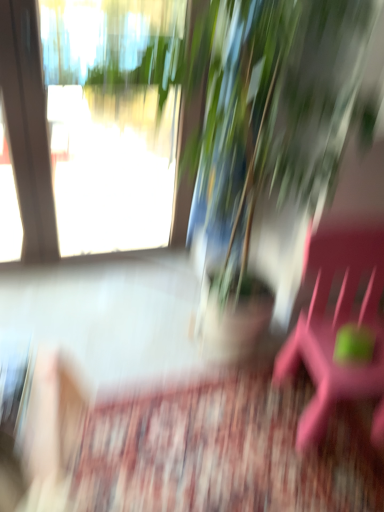
Question: Considering the relative positions of pink plastic beach chair at right and green leafy plant at upper center in the image provided, is pink plastic beach chair at right to the left or to the right of green leafy plant at upper center?

Choices:
 (A) right
 (B) left

Answer: (A)

Question: From a real-world perspective, is pink plastic beach chair at right positioned above or below green leafy plant at upper center?

Choices:
 (A) above
 (B) below

Answer: (B)

Question: From the image's perspective, is pink plastic beach chair at right above or below green leafy plant at upper center?

Choices:
 (A) above
 (B) below

Answer: (B)

Question: Considering the positions of green leafy plant at upper center and pink plastic beach chair at right in the image, is green leafy plant at upper center bigger or smaller than pink plastic beach chair at right?

Choices:
 (A) small
 (B) big

Answer: (B)

Question: Considering the positions of point (311, 110) and point (311, 308), is point (311, 110) closer or farther from the camera than point (311, 308)?

Choices:
 (A) closer
 (B) farther

Answer: (A)

Question: Would you say green leafy plant at upper center is to the left or to the right of pink plastic beach chair at right in the picture?

Choices:
 (A) left
 (B) right

Answer: (A)

Question: Is green leafy plant at upper center in front of or behind pink plastic beach chair at right in the image?

Choices:
 (A) behind
 (B) front

Answer: (A)